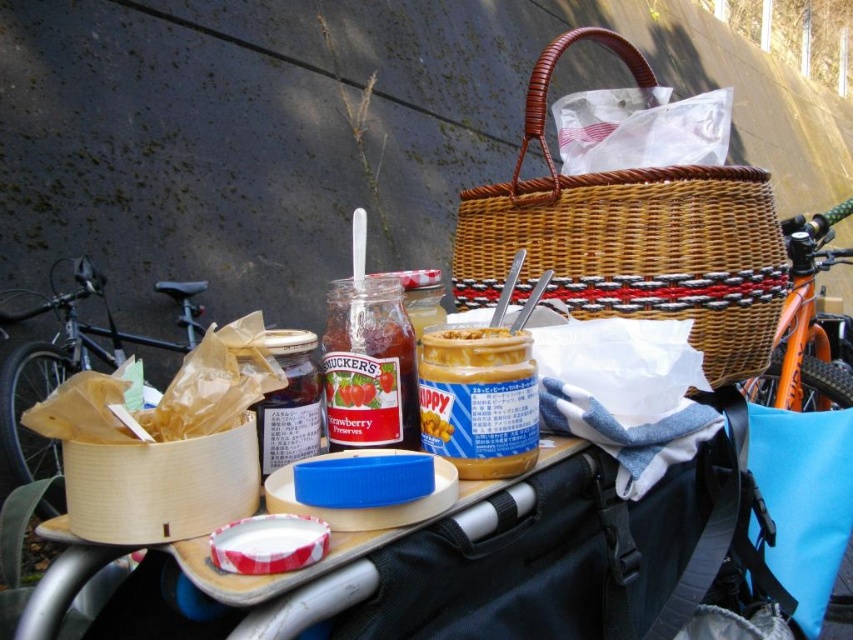
You are a delivery robot trying to place a package on the picnic setup. The package must be placed exactly at point (631, 237). Where should you place the package?

The package should be placed on the woven brown basket at upper center because point (631, 237) is located there.

You are planning to place a small container of yogurt into the picnic basket. Which object should you place it under to ensure it stays cool, the woven brown basket at upper center or the peanut butter jar at center?

The woven brown basket at upper center is wider than the peanut butter jar at center, so it can accommodate the yogurt container better for cooling purposes.

Looking at this image, you are a cyclist who wants to reach the orange matte bicycle at upper right. The woven brown basket at upper center is blocking your path. Can you move around it without disturbing the food items?

The woven brown basket at upper center is located above the orange matte bicycle at upper right, so you can move around it by going underneath the basket since it is positioned above the bicycle.